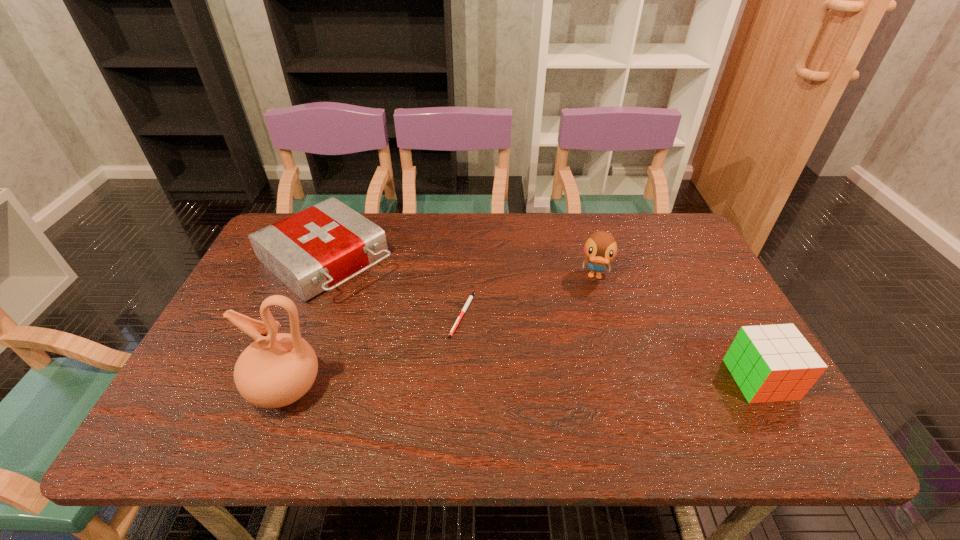
Where is `the tallest object`? the tallest object is located at coordinates (276, 370).

Locate an element on the screen. The height and width of the screenshot is (540, 960). the rightmost object is located at coordinates (770, 363).

Find the location of a particular element. This screenshot has height=540, width=960. the third tallest object is located at coordinates (770, 363).

Locate an element on the screen. This screenshot has width=960, height=540. the second shortest object is located at coordinates (323, 245).

Image resolution: width=960 pixels, height=540 pixels. I want to click on pen, so click(470, 298).

This screenshot has height=540, width=960. Find the location of `the third object from left to right`. the third object from left to right is located at coordinates (470, 298).

You are a GUI agent. You are given a task and a screenshot of the screen. Output one action in this format:
    pyautogui.click(x=<x>, y=<y>)
    Task: Click on the fourth shortest object
    
    Given the screenshot: What is the action you would take?
    pyautogui.click(x=600, y=248)

The image size is (960, 540). I want to click on the fourth object from left to right, so click(x=600, y=248).

The image size is (960, 540). What are the coordinates of `free space located on the spout of the pottery` in the screenshot? It's located at (219, 388).

Locate an element on the screen. This screenshot has width=960, height=540. free space located on the back of the cube is located at coordinates (732, 329).